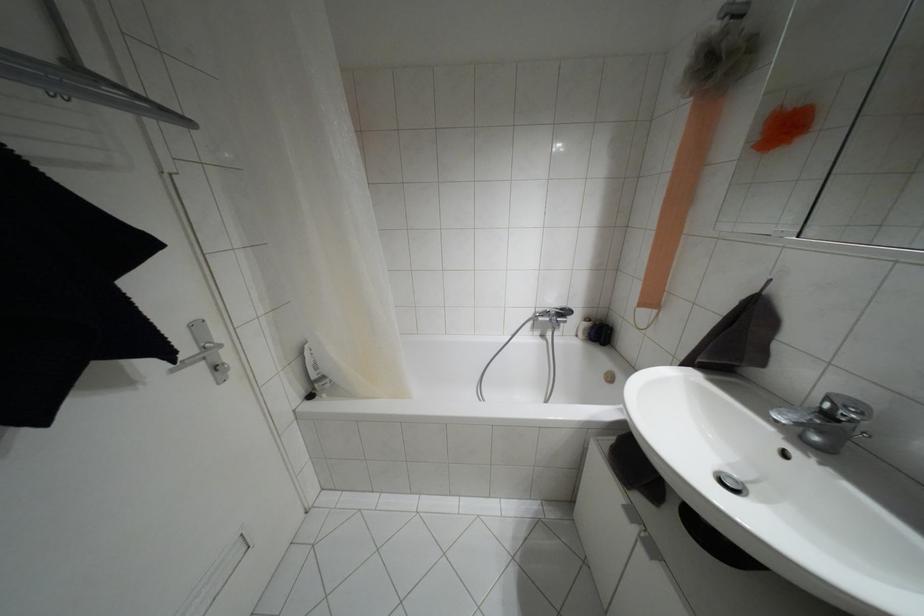
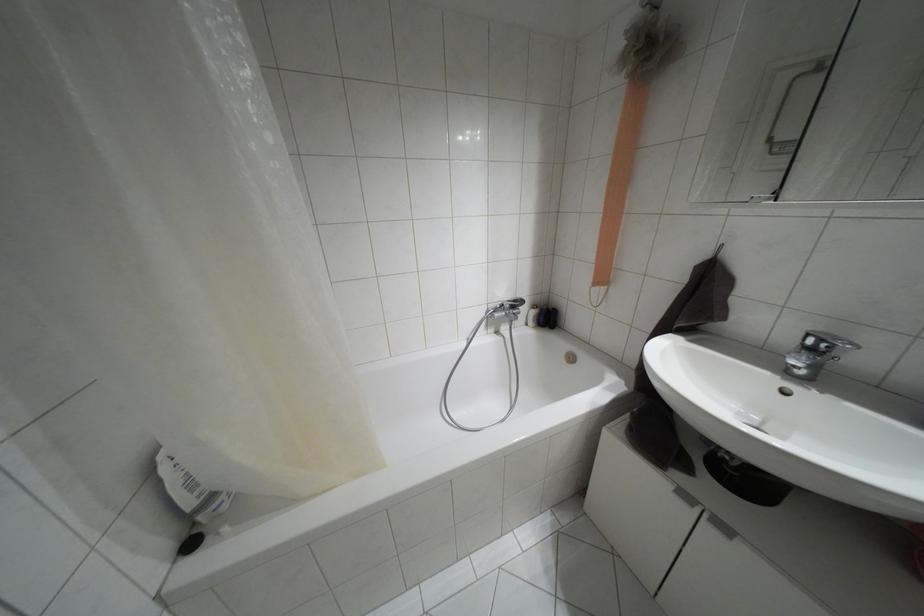
In the second image, find the point that corresponds to point 561,309 in the first image.

(514, 301)